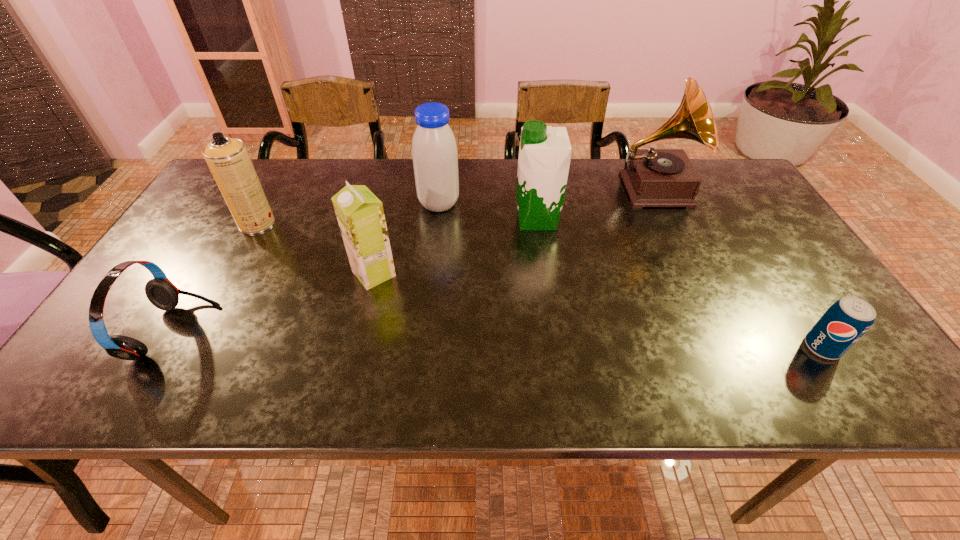
I want to click on free space between the second shortest object and the nearest soya milk, so click(275, 303).

Identify the location of free spot between the aerosol can and the phonograph record. This screenshot has width=960, height=540. (455, 206).

Where is `object that is the fourth closest to the fifth farthest object`? The width and height of the screenshot is (960, 540). object that is the fourth closest to the fifth farthest object is located at coordinates 544,158.

Identify which object is the fourth closest to the fifth object from left to right. Please provide its 2D coordinates. Your answer should be formatted as a tuple, i.e. [(x, y)], where the tuple contains the x and y coordinates of a point satisfying the conditions above.

[(848, 319)]

Locate which soya milk is the closest to the nearest soya milk. Please provide its 2D coordinates. Your answer should be formatted as a tuple, i.e. [(x, y)], where the tuple contains the x and y coordinates of a point satisfying the conditions above.

[(434, 150)]

Locate an element on the screen. soya milk that is the second nearest to the shortest object is located at coordinates point(434,150).

Find the location of a particular element. The image size is (960, 540). vacant space that satisfies the following two spatial constraints: 1. from the horn of the shortest object; 2. on the left side of the phonograph record is located at coordinates (728, 347).

Find the location of `free location that satisfies the following two spatial constraints: 1. on the back side of the shortest object; 2. on the front-facing side of the rightmost soya milk`. free location that satisfies the following two spatial constraints: 1. on the back side of the shortest object; 2. on the front-facing side of the rightmost soya milk is located at coordinates (739, 220).

Where is `vacant position in the image that satisfies the following two spatial constraints: 1. on the front-facing side of the rightmost soya milk; 2. on the front side of the nearest soya milk`? Image resolution: width=960 pixels, height=540 pixels. vacant position in the image that satisfies the following two spatial constraints: 1. on the front-facing side of the rightmost soya milk; 2. on the front side of the nearest soya milk is located at coordinates (545, 273).

Image resolution: width=960 pixels, height=540 pixels. What are the coordinates of `free space that satisfies the following two spatial constraints: 1. from the horn of the second object from right to left; 2. with the microphone attached to the side of the headset` in the screenshot? It's located at (720, 332).